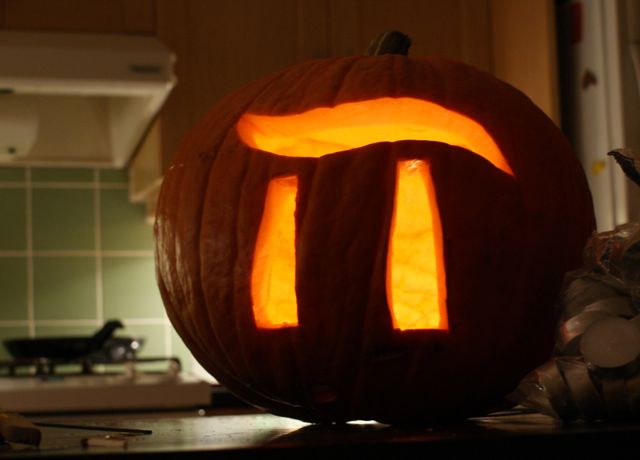
This screenshot has width=640, height=460. In order to click on vent hood in this screenshot , I will do `click(57, 67)`.